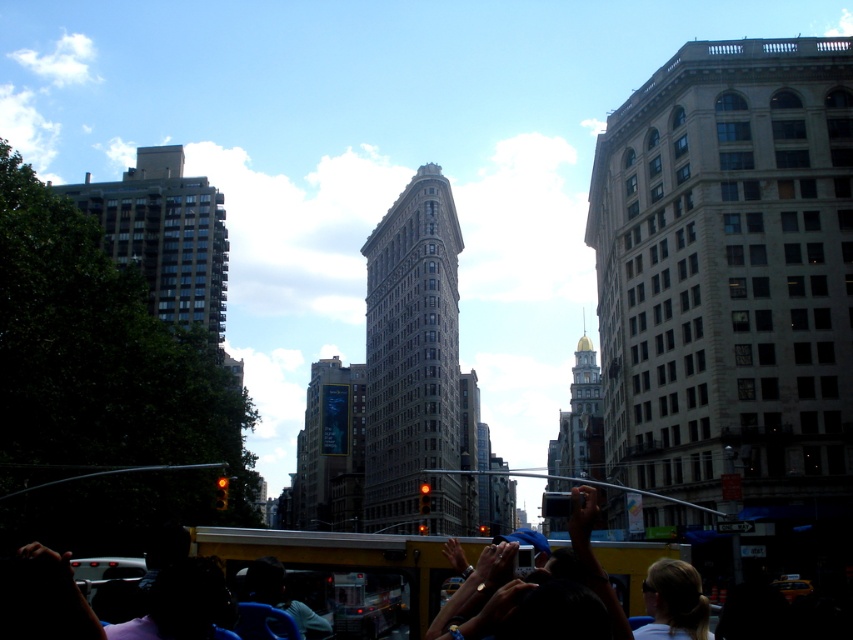
Question: Which of the following is the closest to the observer?

Choices:
 (A) (312, 429)
 (B) (608, 444)
 (C) (317, 534)

Answer: (C)

Question: Can you confirm if matte black cap at center is positioned to the left of goldmaterial/texturetower at center?

Choices:
 (A) no
 (B) yes

Answer: (B)

Question: Which of the following is the closest to the observer?

Choices:
 (A) blonde hair at center
 (B) dark brown concrete building at left
 (C) matte yellow bus at center

Answer: (C)

Question: Among these points, which one is nearest to the camera?

Choices:
 (A) click(585, 628)
 (B) click(215, 554)

Answer: (A)

Question: Is gray stone building at center to the left of matte black cap at center from the viewer's perspective?

Choices:
 (A) no
 (B) yes

Answer: (B)

Question: Is matte black cap at center positioned at the back of blonde hair at center?

Choices:
 (A) no
 (B) yes

Answer: (A)